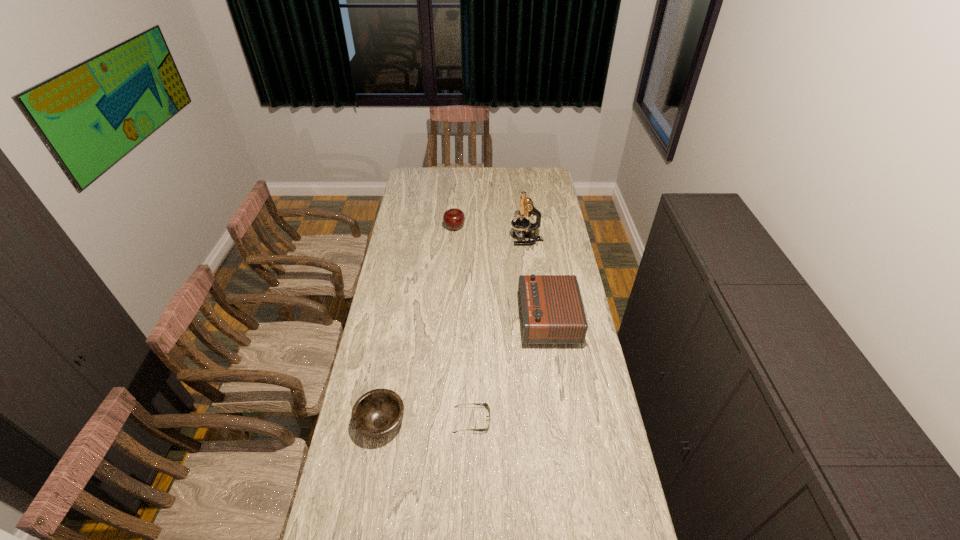
Where is `free space located on the tuning display of the third farthest object`? This screenshot has width=960, height=540. free space located on the tuning display of the third farthest object is located at coordinates click(432, 320).

Locate an element on the screen. free region located on the tuning display of the third farthest object is located at coordinates (460, 320).

Find the location of a particular element. This screenshot has width=960, height=540. vacant space located on the tuning display of the third farthest object is located at coordinates (458, 320).

Find the location of a particular element. free space located on the back of the third shortest object is located at coordinates (457, 188).

Find the location of a particular element. vacant area situated on the back of the leftmost object is located at coordinates click(x=397, y=334).

Locate an element on the screen. The height and width of the screenshot is (540, 960). vacant space positioned on the front-facing side of the shortest object is located at coordinates (563, 420).

Where is `object at the left edge`? object at the left edge is located at coordinates (378, 413).

Find the location of a particular element. microscope located in the right edge section of the desktop is located at coordinates (526, 207).

The height and width of the screenshot is (540, 960). I want to click on radio receiver present at the right edge, so (x=551, y=310).

Locate an element on the screen. vacant space at the far edge of the desktop is located at coordinates (489, 175).